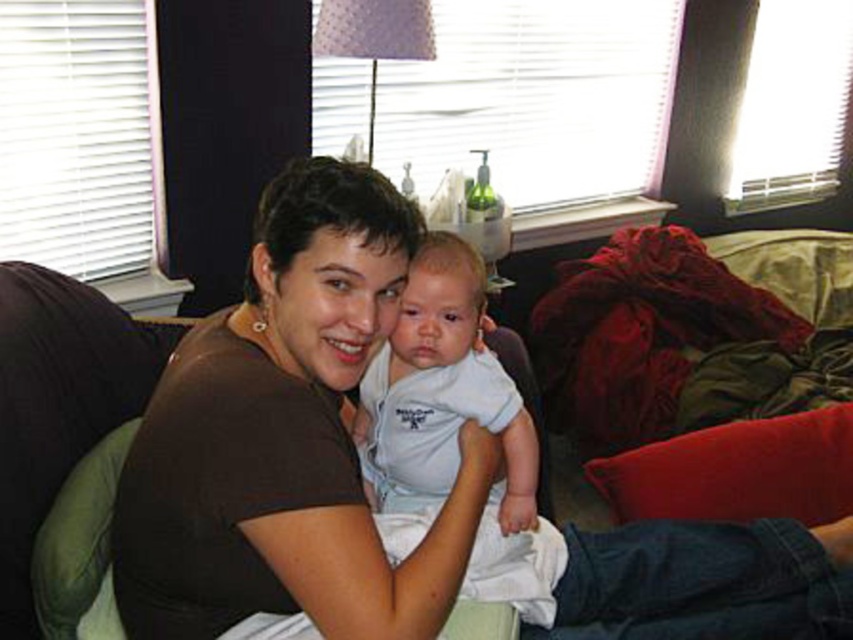
Locate an element on the screen. The image size is (853, 640). brown matte shirt at center is located at coordinates (287, 438).

Does point (408, 250) come farther from viewer compared to point (512, 381)?

No, (408, 250) is in front of (512, 381).

Who is more forward, (x=195, y=621) or (x=465, y=358)?

Point (x=195, y=621)

At what (x,y) coordinates should I click in order to perform the action: click on brown matte shirt at center. Please return your answer as a coordinate pair (x, y). Looking at the image, I should click on (287, 438).